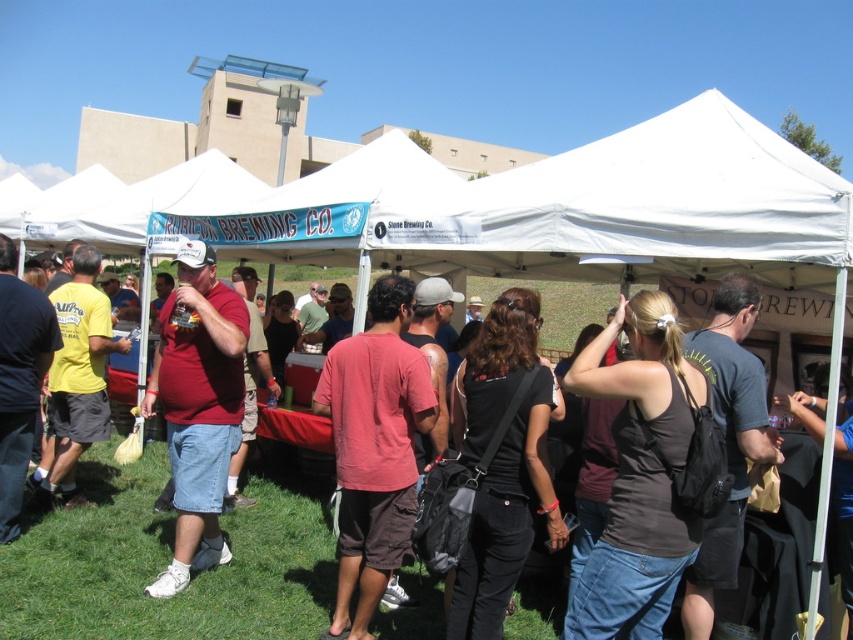
You are attending the festival and notice two people wearing a black matte tank top at center and a brown cotton shirt at center. Which person is standing closer to the ground?

The brown cotton shirt at center is closer to the ground because the black matte tank top at center is above it.

You are attending this outdoor event and want to find a person wearing the taller clothing item between the black matte tank top at center and the brown cotton shirt at center. Which one should you look for?

The brown cotton shirt at center is taller than the black matte tank top at center, so you should look for the brown cotton shirt at center.

You are at the festival and want to take a photo of both the brown cotton shirt at center and the matte red shirt at center. Which shirt should you focus on first to ensure both are in the frame?

You should focus on the brown cotton shirt at center first because it is closer to the viewer than the matte red shirt at center, allowing both to be in the frame when properly focused.